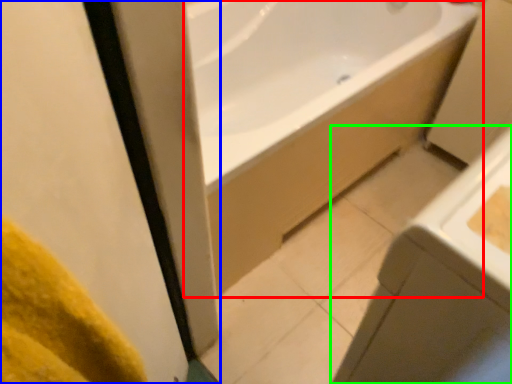
Question: Which is farther away from bathtub (highlighted by a red box)? screen door (highlighted by a blue box) or sink (highlighted by a green box)?

Choices:
 (A) screen door
 (B) sink

Answer: (A)